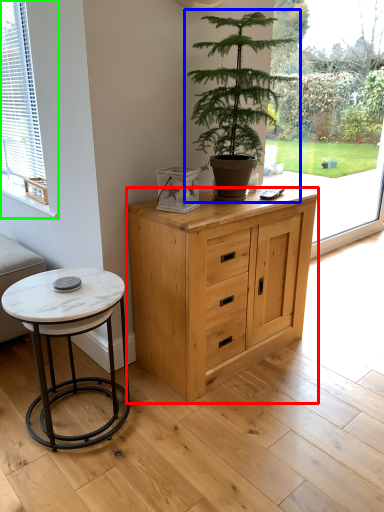
Question: Based on their relative distances, which object is farther from chest of drawers (highlighted by a red box)? Choose from houseplant (highlighted by a blue box) and window (highlighted by a green box).

Choices:
 (A) houseplant
 (B) window

Answer: (B)